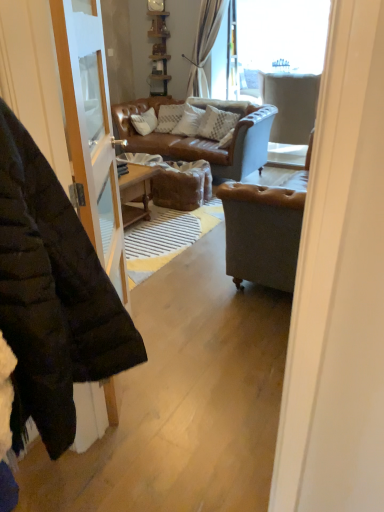
Question: Is light gray fabric armchair at upper right behind black puffer jacket at left?

Choices:
 (A) yes
 (B) no

Answer: (A)

Question: Is light gray fabric armchair at upper right shorter than black puffer jacket at left?

Choices:
 (A) no
 (B) yes

Answer: (B)

Question: From the image's perspective, is light gray fabric armchair at upper right above black puffer jacket at left?

Choices:
 (A) no
 (B) yes

Answer: (B)

Question: Is light gray fabric armchair at upper right wider than black puffer jacket at left?

Choices:
 (A) no
 (B) yes

Answer: (B)

Question: Is light gray fabric armchair at upper right beside black puffer jacket at left?

Choices:
 (A) no
 (B) yes

Answer: (A)

Question: Does light gray fabric armchair at upper right appear on the left side of black puffer jacket at left?

Choices:
 (A) no
 (B) yes

Answer: (A)

Question: From a real-world perspective, is black puffer jacket at left located higher than transparent glass window at upper center?

Choices:
 (A) yes
 (B) no

Answer: (B)

Question: Considering the relative sizes of black puffer jacket at left and transparent glass window at upper center in the image provided, is black puffer jacket at left wider than transparent glass window at upper center?

Choices:
 (A) yes
 (B) no

Answer: (A)

Question: From a real-world perspective, does black puffer jacket at left sit lower than transparent glass window at upper center?

Choices:
 (A) yes
 (B) no

Answer: (A)

Question: From the image's perspective, is black puffer jacket at left below transparent glass window at upper center?

Choices:
 (A) no
 (B) yes

Answer: (B)

Question: Is black puffer jacket at left at the left side of transparent glass window at upper center?

Choices:
 (A) yes
 (B) no

Answer: (A)

Question: Is black puffer jacket at left shorter than transparent glass window at upper center?

Choices:
 (A) yes
 (B) no

Answer: (B)

Question: Can you confirm if textured beige pillow at center is smaller than transparent glass window at upper center?

Choices:
 (A) yes
 (B) no

Answer: (A)